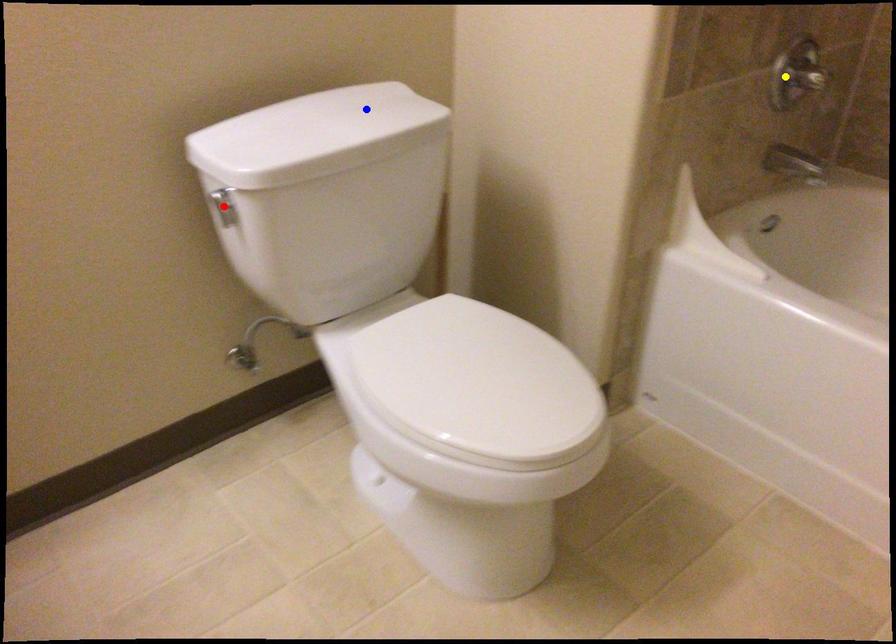
Order these from nearest to farthest:
red point, yellow point, blue point

red point < blue point < yellow point